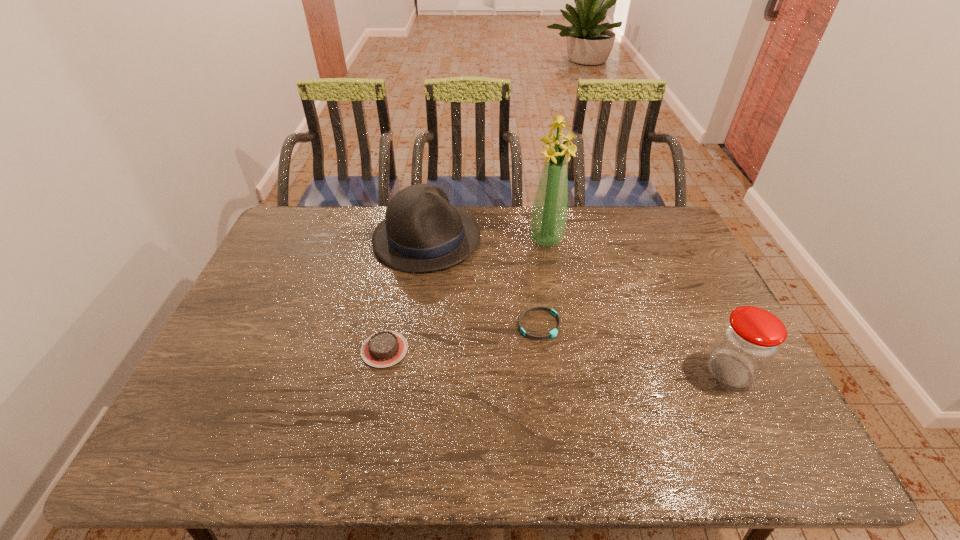
The width and height of the screenshot is (960, 540). In order to click on vacant space located 0.310m on the buckle of the wristband in this screenshot , I will do pos(661,400).

Locate an element on the screen. vacant space located on the buckle of the wristband is located at coordinates (601, 362).

Locate an element on the screen. vacant space located 0.370m on the buckle of the wristband is located at coordinates (685, 415).

At what (x,y) coordinates should I click in order to perform the action: click on free point located on the front-facing side of the tallest object. Please return your answer as a coordinate pair (x, y). This screenshot has height=540, width=960. Looking at the image, I should click on (554, 301).

Where is `vacant space located 0.060m on the front-facing side of the tallest object`? The image size is (960, 540). vacant space located 0.060m on the front-facing side of the tallest object is located at coordinates (549, 262).

The width and height of the screenshot is (960, 540). Find the location of `free region located 0.200m on the front-facing side of the tallest object`. free region located 0.200m on the front-facing side of the tallest object is located at coordinates (552, 292).

The image size is (960, 540). Identify the location of bowler hat that is positioned at the far edge. (422, 232).

The height and width of the screenshot is (540, 960). Find the location of `bouquet that is positioned at the far edge`. bouquet that is positioned at the far edge is located at coordinates (548, 221).

The width and height of the screenshot is (960, 540). I want to click on object at the near edge, so click(749, 340).

Image resolution: width=960 pixels, height=540 pixels. I want to click on object that is at the right edge, so click(749, 340).